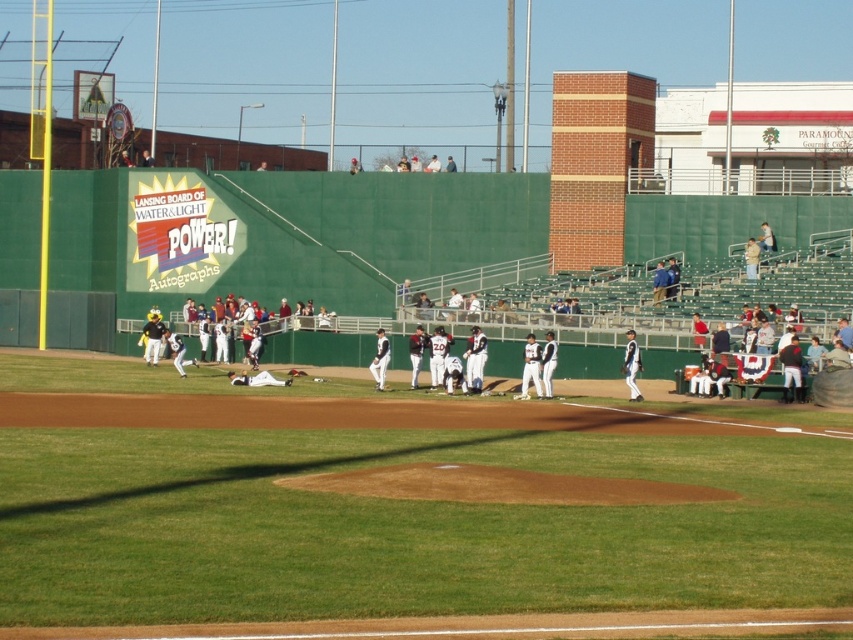
Does green grass field at center have a greater width compared to white uniformed player at center?

Yes.

Which is below, green grass field at center or white uniformed player at center?

green grass field at center

Is point (366, 502) farther from viewer compared to point (375, 378)?

No.

What are the coordinates of `green grass field at center` in the screenshot? It's located at (405, 524).